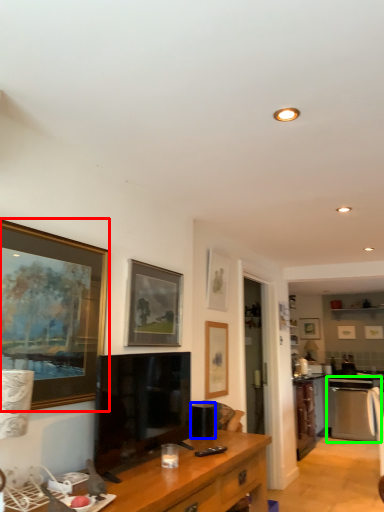
Question: Which object is positioned closest to picture frame (highlighted by a red box)? Select from appliance (highlighted by a blue box) and oven (highlighted by a green box).

Choices:
 (A) appliance
 (B) oven

Answer: (A)